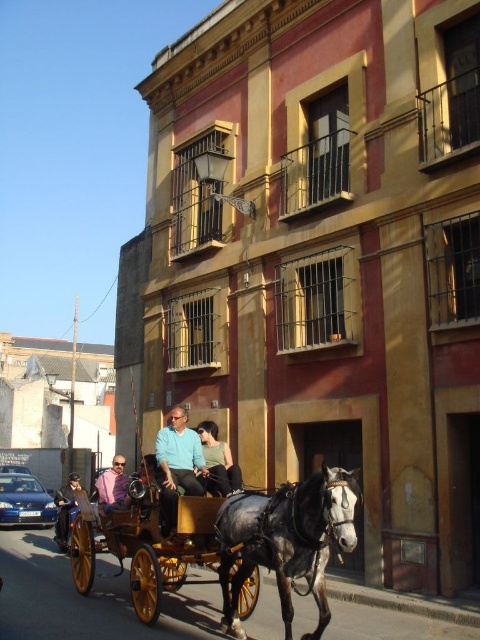
Which of these two, gray glossy horse at center or pink fabric shirt at center, stands taller?

With more height is gray glossy horse at center.

How far apart are gray glossy horse at center and pink fabric shirt at center?

A distance of 4.09 meters exists between gray glossy horse at center and pink fabric shirt at center.

Where is `gray glossy horse at center`? gray glossy horse at center is located at coordinates (287, 540).

Find the location of a particular element. gray glossy horse at center is located at coordinates (287, 540).

Is point (208, 484) positioned before point (69, 477)?

Yes, it is.

Does black leather pants at center appear over dark blue jeans at lower left?

Yes, black leather pants at center is above dark blue jeans at lower left.

Who is more forward, (204, 444) or (74, 492)?

Point (204, 444) is more forward.

Locate an element on the screen. This screenshot has width=480, height=640. black leather pants at center is located at coordinates pyautogui.click(x=217, y=461).

Does wooden polished cart at center appear on the right side of matte blue shirt at center?

Indeed, wooden polished cart at center is positioned on the right side of matte blue shirt at center.

Is wooden polished cart at center behind matte blue shirt at center?

No, wooden polished cart at center is in front of matte blue shirt at center.

Locate an element on the screen. wooden polished cart at center is located at coordinates (143, 540).